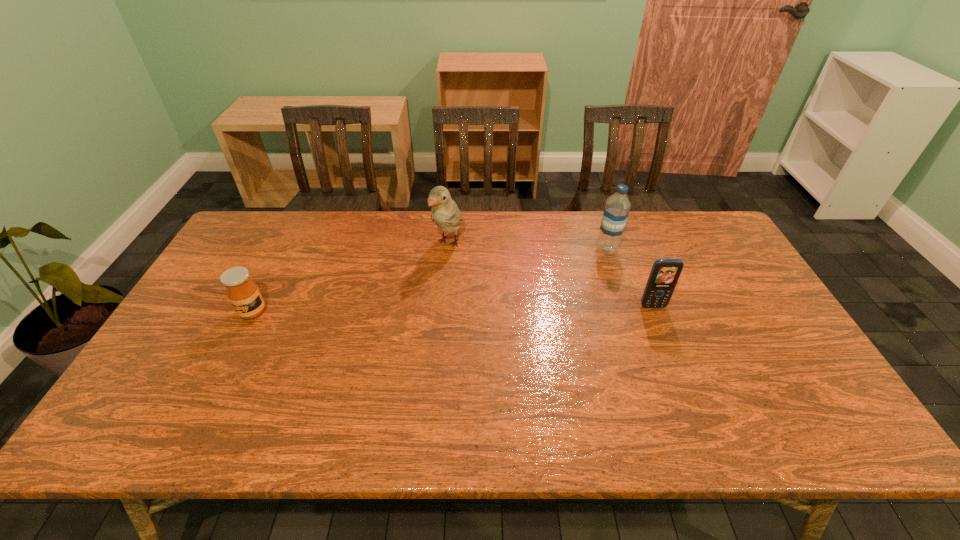
Locate an element on the screen. vacant point located 0.330m on the label of the third object from left to right is located at coordinates (521, 299).

The image size is (960, 540). Identify the location of vacant area situated 0.100m at the face of the third object from right to left. (426, 280).

The width and height of the screenshot is (960, 540). Find the location of `vacant space located 0.180m at the face of the third object from right to left`. vacant space located 0.180m at the face of the third object from right to left is located at coordinates (414, 298).

Locate an element on the screen. vacant position located at the face of the third object from right to left is located at coordinates pos(429,276).

You are a GUI agent. You are given a task and a screenshot of the screen. Output one action in this format:
    pyautogui.click(x=<x>, y=<y>)
    Task: Click on the water bottle at the far edge
    
    Given the screenshot: What is the action you would take?
    pyautogui.click(x=617, y=207)

Locate an element on the screen. The image size is (960, 540). bird positioned at the far edge is located at coordinates (444, 212).

Where is `object that is positioned at the left edge`? The height and width of the screenshot is (540, 960). object that is positioned at the left edge is located at coordinates (242, 292).

This screenshot has height=540, width=960. Identify the location of vacant area at the far edge of the desktop. (421, 235).

Identify the location of vacant region at the near edge of the desktop. The image size is (960, 540). (491, 395).

You are a GUI agent. You are given a task and a screenshot of the screen. Output one action in this format:
    pyautogui.click(x=<x>, y=<y>)
    Task: Click on the vacant space at the left edge
    
    Given the screenshot: What is the action you would take?
    pyautogui.click(x=190, y=315)